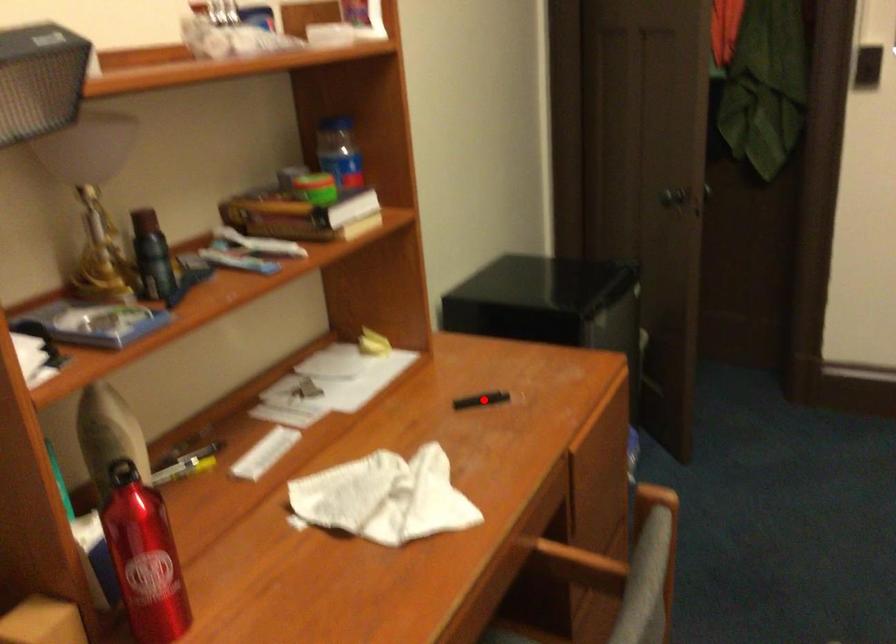
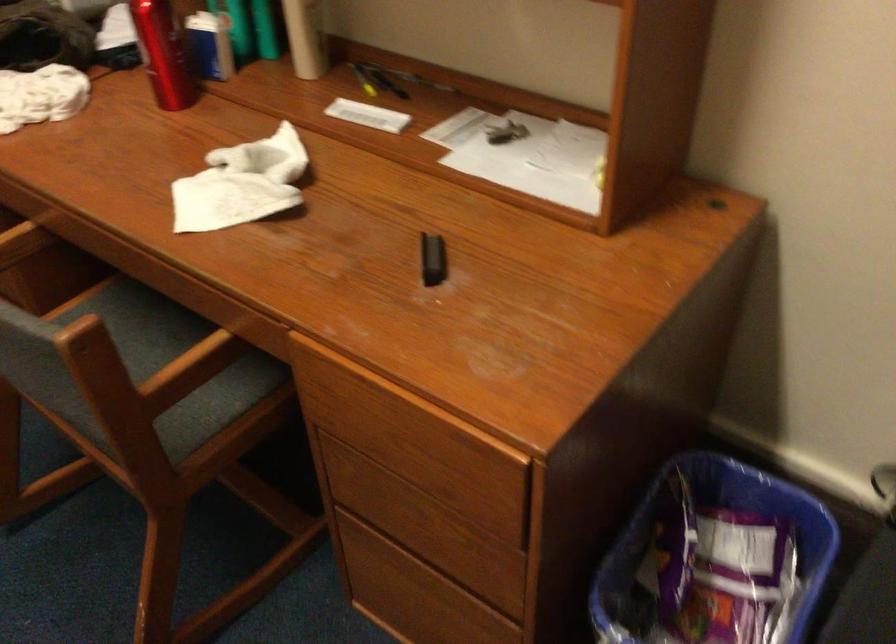
Question: I am providing you with two images of the same scene from different viewpoints. Image1 has a red point marked. In image2, the corresponding 3D location appears at what relative position? Reply with the corresponding letter.

Choices:
 (A) Closer
 (B) Farther

Answer: (A)